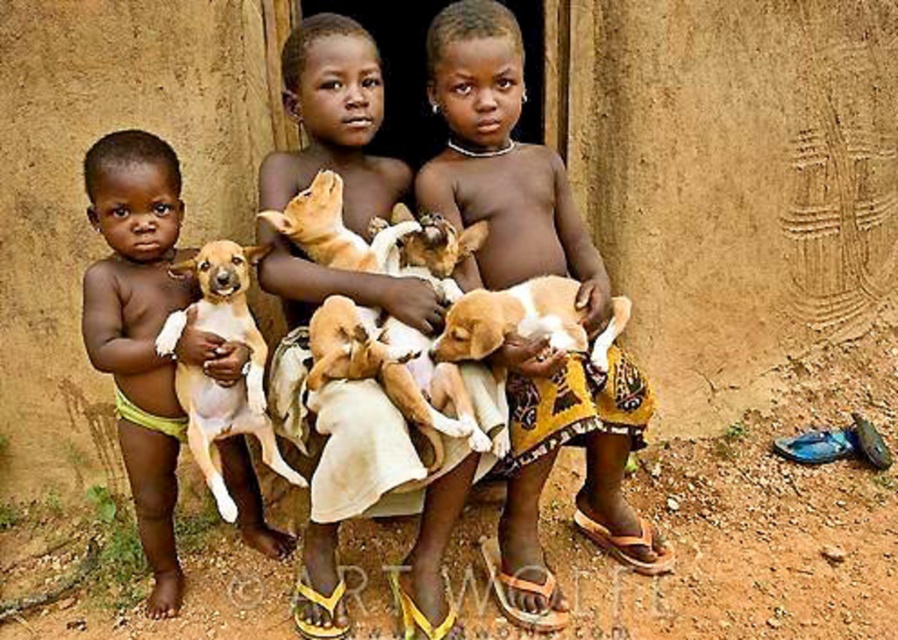
Question: Is light brown fur puppy at left wider than brown furry dog at left?

Choices:
 (A) no
 (B) yes

Answer: (B)

Question: Which object is the closest to the brown furry dog at left?

Choices:
 (A) light brown fur dog at center
 (B) brown fur dog at center

Answer: (A)

Question: Observing the image, what is the correct spatial positioning of light brown fur puppy at left in reference to brown furry dog at left?

Choices:
 (A) right
 (B) left

Answer: (B)

Question: Is brown fur dog at center to the left of brown furry dog at left from the viewer's perspective?

Choices:
 (A) yes
 (B) no

Answer: (B)

Question: Which object appears farthest from the camera in this image?

Choices:
 (A) light brown fur dog at center
 (B) brown fur dog at center
 (C) brown furry dog at left
 (D) light brown fur puppy at left

Answer: (D)

Question: Which is farther from the light brown fur puppy at left?

Choices:
 (A) brown furry dog at left
 (B) brown fur dog at center
 (C) light brown fur dog at center

Answer: (B)